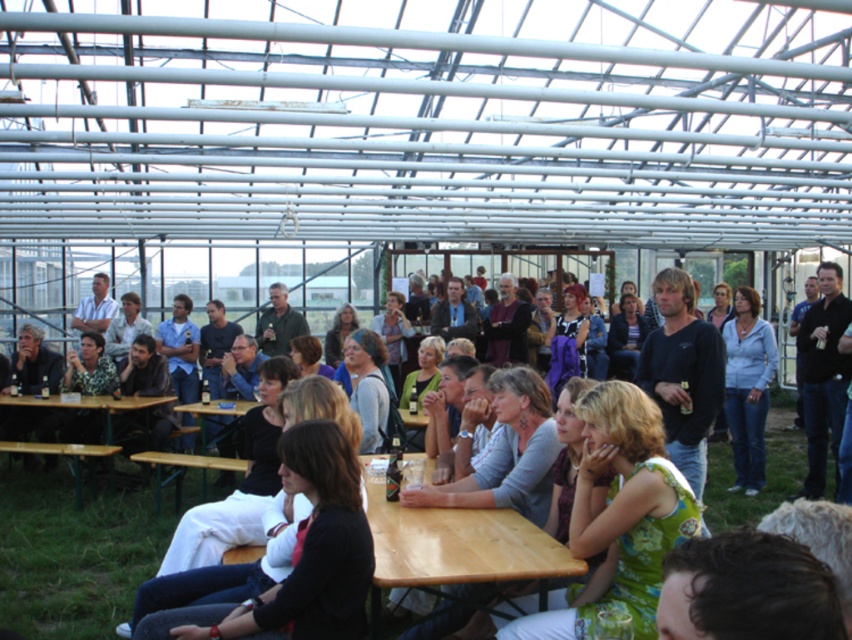
Does wooden table at center appear over wooden picnic table at lower left?

Yes, wooden table at center is above wooden picnic table at lower left.

Where is `wooden table at center`? This screenshot has width=852, height=640. wooden table at center is located at coordinates (455, 547).